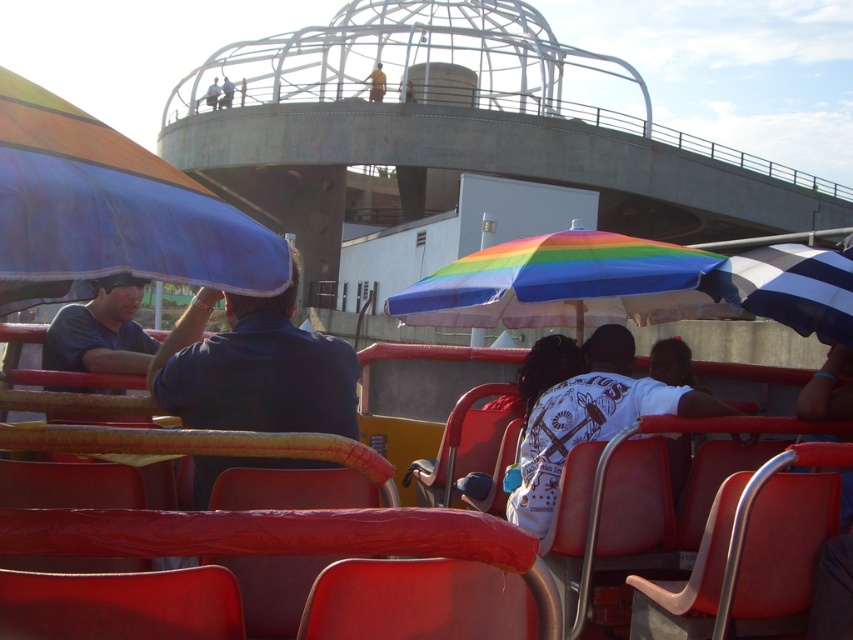
Question: Which point appears closest to the camera in this image?

Choices:
 (A) tap(109, 227)
 (B) tap(556, 278)

Answer: (A)

Question: Which object appears closest to the camera in this image?

Choices:
 (A) matte blue shirt at left
 (B) white matte shirt at center

Answer: (A)

Question: Which point is closer to the camera?

Choices:
 (A) matte blue shirt at left
 (B) yellow shirt at upper center
 (C) blue fabric umbrella at left

Answer: (C)

Question: Can you confirm if blue fabric umbrella at left is positioned above yellow shirt at upper center?

Choices:
 (A) yes
 (B) no

Answer: (B)

Question: Is matte blue shirt at left smaller than yellow fabric umbrella at upper center?

Choices:
 (A) yes
 (B) no

Answer: (A)

Question: Does blue fabric umbrella at left appear over yellow shirt at upper center?

Choices:
 (A) no
 (B) yes

Answer: (A)